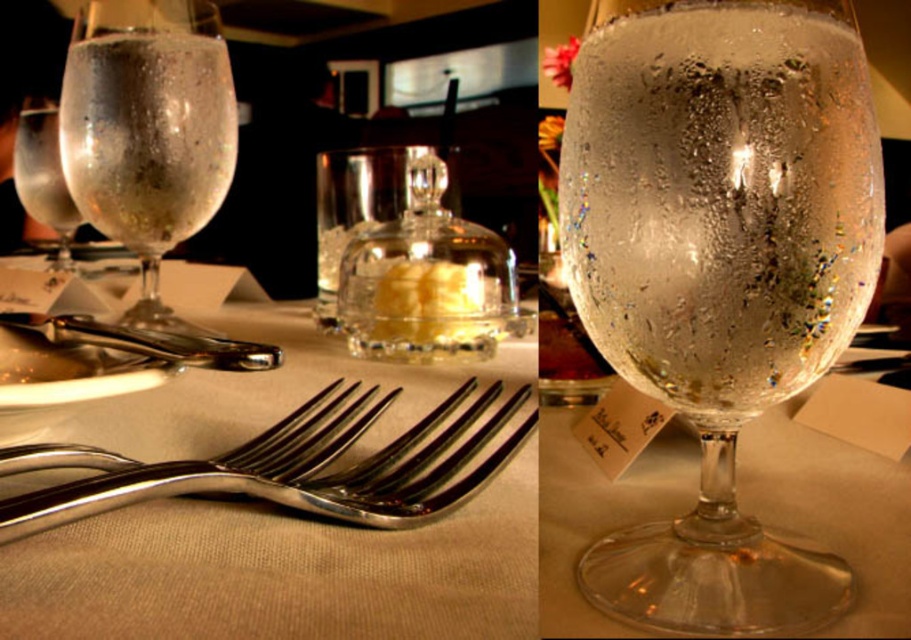
Question: In this image, where is translucent speckled glass at center located relative to clear textured glass at upper left?

Choices:
 (A) below
 (B) above

Answer: (A)

Question: Is the position of translucent speckled glass at center more distant than that of polished silver fork at lower left?

Choices:
 (A) yes
 (B) no

Answer: (A)

Question: Which object is closer to the camera taking this photo?

Choices:
 (A) translucent speckled glass at center
 (B) polished silver fork at lower center
 (C) clear textured glass at upper left

Answer: (B)

Question: Which point is farther to the camera?

Choices:
 (A) (57, 216)
 (B) (280, 472)
 (C) (154, 552)
 (D) (730, 154)

Answer: (A)

Question: Among these points, which one is nearest to the camera?

Choices:
 (A) (396, 513)
 (B) (200, 602)
 (C) (704, 22)
 (D) (192, 352)

Answer: (C)

Question: Does translucent glass wine glass at center have a smaller size compared to polished silver fork at lower left?

Choices:
 (A) no
 (B) yes

Answer: (A)